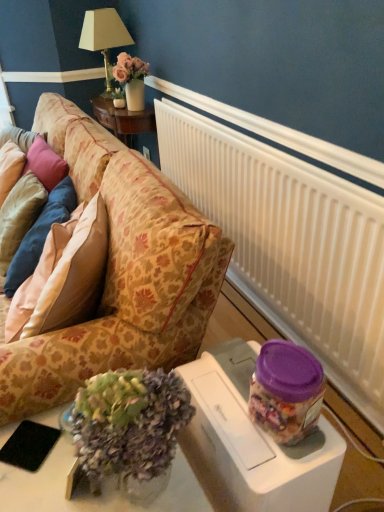
Describe the element at coordinates (29, 445) in the screenshot. This screenshot has height=512, width=384. I see `black matte pad at lower left` at that location.

What do you see at coordinates (104, 39) in the screenshot? Image resolution: width=384 pixels, height=512 pixels. I see `gold metallic table lamp at upper left` at bounding box center [104, 39].

This screenshot has height=512, width=384. Find the location of `transparent plastic container at lower right, the 1th table in the right-to-left sequence`. transparent plastic container at lower right, the 1th table in the right-to-left sequence is located at coordinates [x=245, y=448].

Find the location of `pink satin pillow at left, which is counted as the 2th pillow, starting from the right`. pink satin pillow at left, which is counted as the 2th pillow, starting from the right is located at coordinates (40, 234).

At what (x,y) coordinates should I click in order to perform the action: click on black matte pad at lower left. Please return your answer as a coordinate pair (x, y). Image resolution: width=384 pixels, height=512 pixels. Looking at the image, I should click on (29, 445).

Does point (43, 304) appear closer or farther from the camera than point (311, 461)?

Point (43, 304) is farther from the camera than point (311, 461).

Is pink satin pillow at left, the first pillow positioned from the right, positioned with its back to transparent plastic container at lower right, marked as the 2th table in a left-to-right arrangement?

No, pink satin pillow at left, the first pillow positioned from the right, is not facing away from transparent plastic container at lower right, marked as the 2th table in a left-to-right arrangement.

Looking at the image, does pink satin pillow at left, which is the 3th pillow from left to right, seem bigger or smaller compared to transparent plastic container at lower right, marked as the 2th table in a left-to-right arrangement?

In the image, pink satin pillow at left, which is the 3th pillow from left to right, appears to be smaller than transparent plastic container at lower right, marked as the 2th table in a left-to-right arrangement.

How much distance is there between floral-patterned fabric couch at left and black matte pad at lower left?

The distance of floral-patterned fabric couch at left from black matte pad at lower left is 27.58 inches.

Which is nearer, (x=53, y=339) or (x=48, y=443)?

Point (x=48, y=443)

Would you say black matte pad at lower left is part of floral-patterned fabric couch at left's contents?

Actually, black matte pad at lower left is outside floral-patterned fabric couch at left.

From a real-world perspective, does floral-patterned fabric couch at left stand above black matte pad at lower left?

Incorrect, from a real-world perspective, floral-patterned fabric couch at left is lower than black matte pad at lower left.

Who is taller, transparent plastic container at lower right, the 1th table in the right-to-left sequence, or pink satin pillow at left, which is counted as the 2th pillow, starting from the right?

transparent plastic container at lower right, the 1th table in the right-to-left sequence.

Is transparent plastic container at lower right, marked as the 2th table in a left-to-right arrangement, further to camera compared to pink satin pillow at left, which is counted as the 2th pillow, starting from the right?

No.

From the image's perspective, would you say transparent plastic container at lower right, marked as the 2th table in a left-to-right arrangement, is shown under pink satin pillow at left, the second pillow from the left?

Yes.

Could you tell me if transparent plastic container at lower right, the 1th table in the right-to-left sequence, is turned towards black matte pad at lower left?

Yes, transparent plastic container at lower right, the 1th table in the right-to-left sequence, is facing black matte pad at lower left.

Identify the location of pad that appears on the left of transparent plastic container at lower right, marked as the 2th table in a left-to-right arrangement. (29, 445).

Considering the relative positions of transparent plastic container at lower right, marked as the 2th table in a left-to-right arrangement, and black matte pad at lower left in the image provided, is transparent plastic container at lower right, marked as the 2th table in a left-to-right arrangement, to the left or to the right of black matte pad at lower left?

Based on their positions, transparent plastic container at lower right, marked as the 2th table in a left-to-right arrangement, is located to the right of black matte pad at lower left.

From the image's perspective, would you say pink satin pillow at left, which is the 3th pillow from left to right, is positioned over floral-patterned fabric couch at left?

No, from the image's perspective, pink satin pillow at left, which is the 3th pillow from left to right, is not above floral-patterned fabric couch at left.

From a real-world perspective, is pink satin pillow at left, the first pillow positioned from the right, physically located above or below floral-patterned fabric couch at left?

Clearly, from a real-world perspective, pink satin pillow at left, the first pillow positioned from the right, is above floral-patterned fabric couch at left.

Does transparent plastic container at lower right, marked as the 2th table in a left-to-right arrangement, have a larger size compared to translucent glass vase at lower left?

Yes, transparent plastic container at lower right, marked as the 2th table in a left-to-right arrangement, is bigger than translucent glass vase at lower left.

Can you confirm if transparent plastic container at lower right, the 1th table in the right-to-left sequence, is taller than translucent glass vase at lower left?

Correct, transparent plastic container at lower right, the 1th table in the right-to-left sequence, is much taller as translucent glass vase at lower left.

How much distance is there between transparent plastic container at lower right, the 1th table in the right-to-left sequence, and translucent glass vase at lower left?

The distance of transparent plastic container at lower right, the 1th table in the right-to-left sequence, from translucent glass vase at lower left is 7.62 inches.

From a real-world perspective, between transparent plastic container at lower right, marked as the 2th table in a left-to-right arrangement, and translucent glass vase at lower left, who is vertically lower?

transparent plastic container at lower right, marked as the 2th table in a left-to-right arrangement, is physically lower.

In terms of size, does white plastic radiator at upper right appear bigger or smaller than translucent glass vase at lower left?

white plastic radiator at upper right is bigger than translucent glass vase at lower left.

In terms of width, does white plastic radiator at upper right look wider or thinner when compared to translucent glass vase at lower left?

Clearly, white plastic radiator at upper right has less width compared to translucent glass vase at lower left.

From a real-world perspective, is white plastic radiator at upper right above or below translucent glass vase at lower left?

In terms of real-world spatial position, white plastic radiator at upper right is below translucent glass vase at lower left.

Is the position of white plastic radiator at upper right less distant than that of translucent glass vase at lower left?

No, white plastic radiator at upper right is further to the viewer.

Where is `the 1st pillow behind the transparent plastic container at lower right, the 1th table in the right-to-left sequence, counting from the anchor's position`? Image resolution: width=384 pixels, height=512 pixels. the 1st pillow behind the transparent plastic container at lower right, the 1th table in the right-to-left sequence, counting from the anchor's position is located at coordinates click(x=66, y=279).

The image size is (384, 512). Identify the location of studio couch above the black matte pad at lower left (from the image's perspective). (121, 273).

Looking at this image, from the image, which object appears to be farther from gold metallic table lamp at upper left, translucent glass vase at lower center, which appears as the second table when viewed from the right, or floral-patterned fabric couch at left?

translucent glass vase at lower center, which appears as the second table when viewed from the right.

Which object lies further to the anchor point translucent glass vase at lower left, pink satin pillow at left, the third pillow viewed from the right, or black matte pad at lower left?

The object further to translucent glass vase at lower left is pink satin pillow at left, the third pillow viewed from the right.

Estimate the real-world distances between objects in this image. Which object is further from translucent glass vase at lower center, which appears as the second table when viewed from the right, translucent glass vase at lower left or pink satin pillow at left, which is the 3th pillow from left to right?

pink satin pillow at left, which is the 3th pillow from left to right, lies further to translucent glass vase at lower center, which appears as the second table when viewed from the right, than the other object.

Considering their positions, is pink satin pillow at left, the first pillow positioned from the right, positioned further to floral-patterned fabric couch at left than translucent glass vase at lower center, which appears as the second table when viewed from the right?

Among the two, translucent glass vase at lower center, which appears as the second table when viewed from the right, is located further to floral-patterned fabric couch at left.

Which object lies nearer to the anchor point translucent glass vase at lower left, floral-patterned fabric couch at left or transparent plastic container at lower right, the 1th table in the right-to-left sequence?

transparent plastic container at lower right, the 1th table in the right-to-left sequence, is positioned closer to the anchor translucent glass vase at lower left.

Looking at this image, looking at the image, which one is located closer to pink satin pillow at left, the third pillow viewed from the right, translucent glass vase at lower left or gold metallic table lamp at upper left?

translucent glass vase at lower left is positioned closer to the anchor pink satin pillow at left, the third pillow viewed from the right.

From the image, which object appears to be nearer to translucent glass vase at lower center, the first table viewed from the left, pink satin pillow at left, which is counted as the 2th pillow, starting from the right, or white plastic radiator at upper right?

pink satin pillow at left, which is counted as the 2th pillow, starting from the right.

Which object lies nearer to the anchor point floral-patterned fabric couch at left, translucent glass vase at lower center, which appears as the second table when viewed from the right, or white plastic radiator at upper right?

translucent glass vase at lower center, which appears as the second table when viewed from the right, is positioned closer to the anchor floral-patterned fabric couch at left.

In order to click on pillow positioned between pink satin pillow at left, the first pillow positioned from the right, and pink satin pillow at left, the third pillow viewed from the right, from near to far in this screenshot , I will do `click(40, 234)`.

Identify the location of pad between floral-patterned fabric couch at left and pink satin pillow at left, the third pillow viewed from the right, in the front-back direction. The width and height of the screenshot is (384, 512). (29, 445).

Image resolution: width=384 pixels, height=512 pixels. I want to click on pillow between pink satin pillow at left, the second pillow from the left, and white plastic radiator at upper right, so click(x=66, y=279).

Locate an element on the screen. The height and width of the screenshot is (512, 384). floral arrangement situated between black matte pad at lower left and transparent plastic container at lower right, the 1th table in the right-to-left sequence, from left to right is located at coordinates (127, 426).